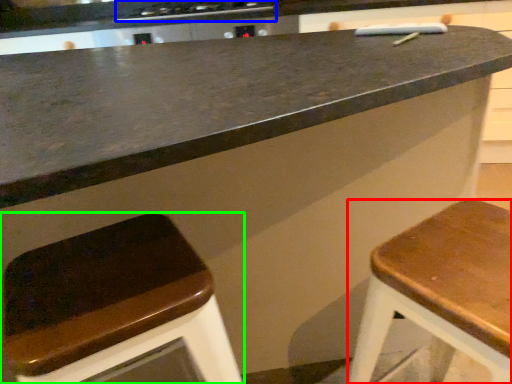
Question: Estimate the real-world distances between objects in this image. Which object is farther from stool (highlighted by a red box), stove (highlighted by a blue box) or stool (highlighted by a green box)?

Choices:
 (A) stove
 (B) stool

Answer: (A)